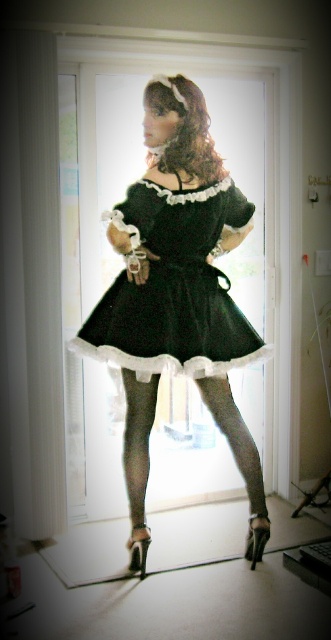
You are standing in front of the glass door wearing a black dress with frilly white trim. You want to take a photo of yourself using a camera that is 2.38 meters away. Can you fit your entire body into the frame if the camera is positioned at point (143, 385)?

The point (143, 385) and camera are 2.38 meters apart from each other, so yes, you can fit your entire body into the frame since the distance between you and the camera is sufficient to capture your full figure.

You are a photographer standing 2 meters away from the glass door in the image. You want to take a photo of the person standing at point (177, 259). Will you be able to capture them clearly without moving closer?

The distance of point (177, 259) from the camera is 2.31 meters. Since you are standing 2 meters away from the glass door, the total distance between you and the person would be 2 meters plus the distance from the door to the person. However, the given information only specifies the distance from the camera to the point, not the distance from the door to the person. Therefore, it is unclear if you can capture them clearly without additional information about the door to person distance.